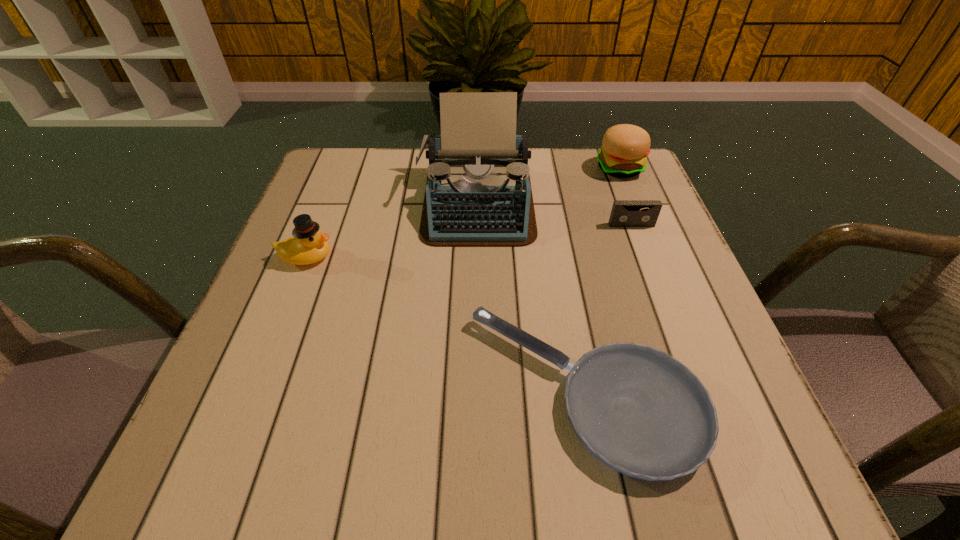
In the image, there is a desktop. Where is `free space at the far edge`? free space at the far edge is located at coordinates (393, 195).

This screenshot has width=960, height=540. In order to click on free space at the near edge in this screenshot , I will do `click(299, 478)`.

I want to click on blank space at the left edge of the desktop, so click(311, 265).

In the image, there is a desktop. Identify the location of free space at the right edge. The height and width of the screenshot is (540, 960). (629, 303).

You are a GUI agent. You are given a task and a screenshot of the screen. Output one action in this format:
    pyautogui.click(x=<x>, y=<y>)
    Task: Click on the vacant space at the far left corner of the desktop
    
    Given the screenshot: What is the action you would take?
    pyautogui.click(x=337, y=163)

Find the location of a particular element. The height and width of the screenshot is (540, 960). vacant space at the far right corner of the desktop is located at coordinates (591, 148).

The image size is (960, 540). Find the location of `free space between the nearest object and the hamburger`. free space between the nearest object and the hamburger is located at coordinates (602, 280).

This screenshot has height=540, width=960. What are the coordinates of `free space between the hamburger and the nearest object` in the screenshot? It's located at (602, 280).

At what (x,y) coordinates should I click in order to perform the action: click on vacant area that lies between the typewriter and the videotape. Please return your answer as a coordinate pair (x, y). Looking at the image, I should click on (554, 214).

Locate an element on the screen. The height and width of the screenshot is (540, 960). free space between the videotape and the frying pan is located at coordinates (609, 308).